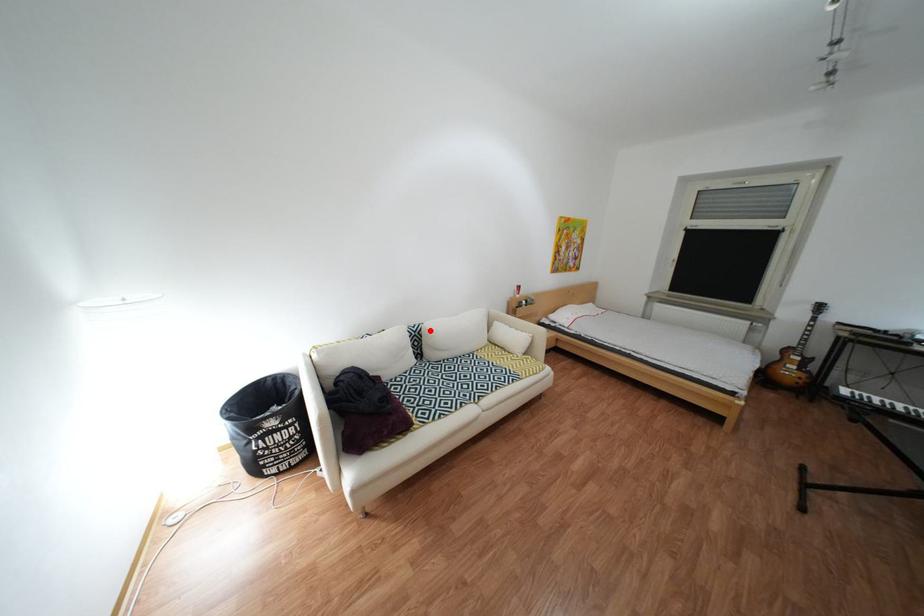
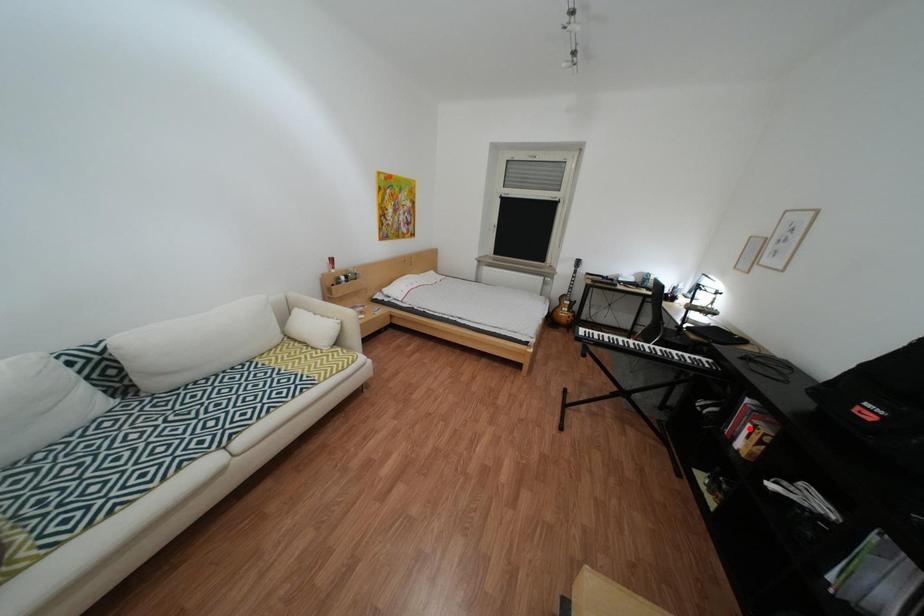
I am providing you with two images of the same scene from different viewpoints. A red point is marked on the first image and another point is marked on the second image. Is the marked point in image1 the same physical position as the marked point in image2?

No